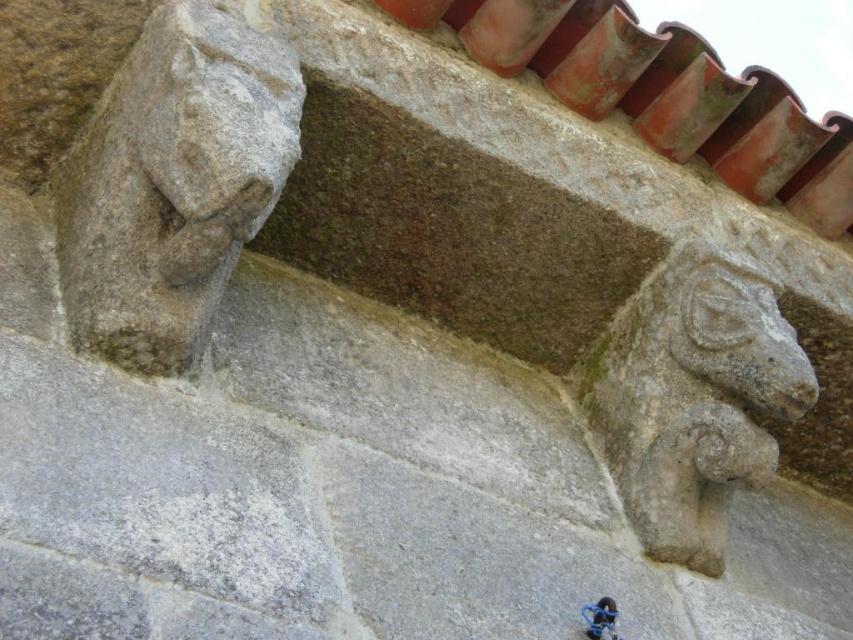
You are an architect examining the stone carvings and the bicycle in the image. Which object is taller between the gray stone carving at upper left and the blue metallic bicycle at lower right?

The gray stone carving at upper left is much taller than the blue metallic bicycle at lower right according to the description.

You are an architect examining this historical building detail. You see the gray stone ram at upper right and the blue metallic bicycle at lower right. Which object is positioned higher up in the image?

The gray stone ram at upper right is positioned higher up in the image than the blue metallic bicycle at lower right.

You are a delivery person trying to place a blue metallic bicycle at lower right near the gray stone carving at upper left. The minimum distance required between the bicycle and any object is 30 inches for safety. Is the current placement safe?

The gray stone carving at upper left is 28.37 inches from the blue metallic bicycle at lower right. Since 28.37 inches is less than the required 30 inches, the current placement is not safe and does not meet the safety distance requirement.